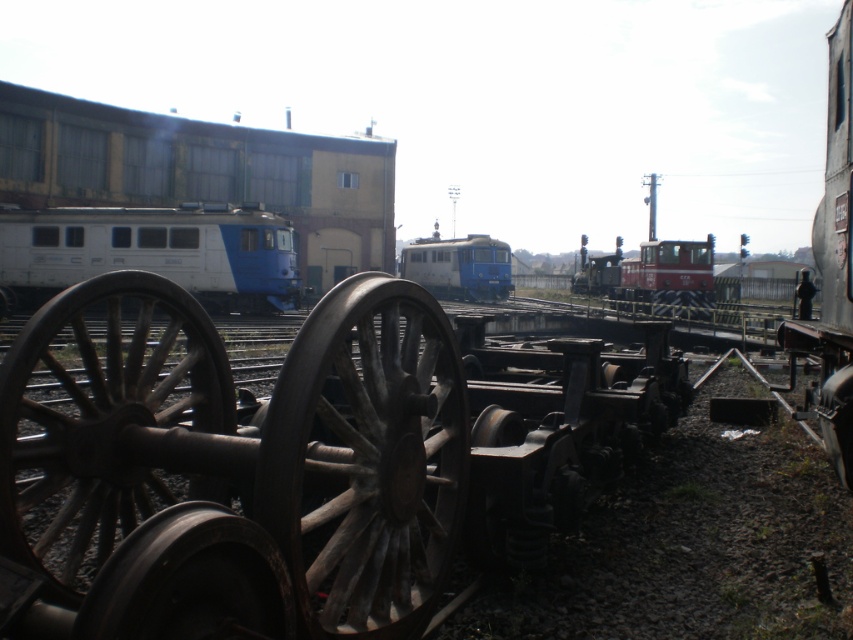
Who is taller, rusty metal wheel at lower left or red matte train at center?

With more height is red matte train at center.

Is point (112, 376) closer to viewer compared to point (583, 250)?

That is True.

The width and height of the screenshot is (853, 640). In order to click on rusty metal wheel at lower left in this screenshot , I will do `click(103, 420)`.

Where is `rusty metal wheel at lower left`? This screenshot has height=640, width=853. rusty metal wheel at lower left is located at coordinates (103, 420).

Is rusty metal wheel at lower left shorter than rusty metal train at right?

Yes.

Who is positioned more to the left, rusty metal wheel at lower left or rusty metal train at right?

From the viewer's perspective, rusty metal wheel at lower left appears more on the left side.

Is point (15, 445) closer to viewer compared to point (837, 200)?

Yes, point (15, 445) is closer to viewer.

At what (x,y) coordinates should I click in order to perform the action: click on rusty metal wheel at lower left. Please return your answer as a coordinate pair (x, y). Looking at the image, I should click on (103, 420).

Who is shorter, rusty wood wheel at center or red matte train at center?

rusty wood wheel at center

The width and height of the screenshot is (853, 640). In order to click on rusty wood wheel at center in this screenshot , I will do `click(366, 460)`.